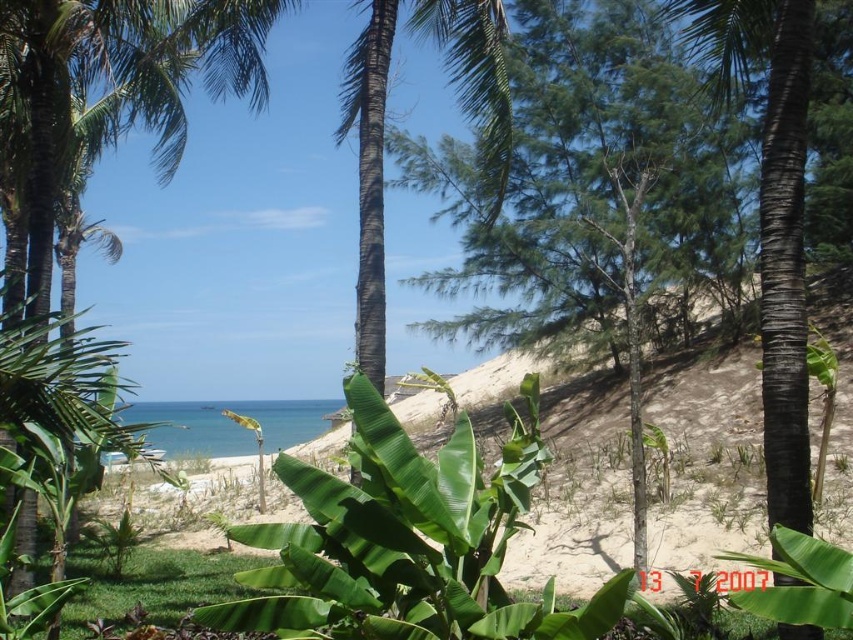
Question: Where is green leafy palm tree at left located in relation to black textured palm tree at center in the image?

Choices:
 (A) above
 (B) below

Answer: (A)

Question: Does green leafy palm tree at left appear on the right side of black textured palm tree at center?

Choices:
 (A) no
 (B) yes

Answer: (A)

Question: Does green leafy palm tree at left appear on the right side of black textured palm tree at center?

Choices:
 (A) yes
 (B) no

Answer: (B)

Question: Among these objects, which one is farthest from the camera?

Choices:
 (A) black textured palm tree at center
 (B) green leafy palm tree at left

Answer: (B)

Question: Which of the following is the farthest from the observer?

Choices:
 (A) black textured palm tree at center
 (B) green leafy palm tree at left

Answer: (B)